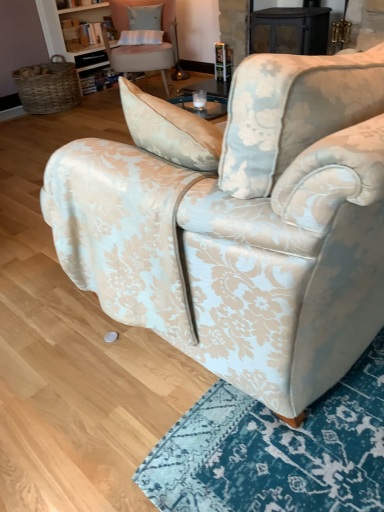
Question: In terms of height, does pastel pink fabric chair at upper center, the second chair viewed from the right, look taller or shorter compared to floral fabric armchair at center, arranged as the first chair when viewed from the right?

Choices:
 (A) short
 (B) tall

Answer: (B)

Question: Looking at their shapes, would you say pastel pink fabric chair at upper center, the second chair viewed from the right, is wider or thinner than floral fabric armchair at center, arranged as the first chair when viewed from the right?

Choices:
 (A) wide
 (B) thin

Answer: (B)

Question: Considering the positions of point (163, 33) and point (48, 167), is point (163, 33) closer or farther from the camera than point (48, 167)?

Choices:
 (A) closer
 (B) farther

Answer: (B)

Question: Considering the positions of floral fabric armchair at center, positioned as the 2th chair in left-to-right order, and pastel pink fabric chair at upper center, the second chair viewed from the right, in the image, is floral fabric armchair at center, positioned as the 2th chair in left-to-right order, bigger or smaller than pastel pink fabric chair at upper center, the second chair viewed from the right,?

Choices:
 (A) small
 (B) big

Answer: (B)

Question: In the image, is floral fabric armchair at center, positioned as the 2th chair in left-to-right order, positioned in front of or behind pastel pink fabric chair at upper center, which appears as the 1th chair when viewed from the left?

Choices:
 (A) front
 (B) behind

Answer: (A)

Question: Which is correct: floral fabric armchair at center, positioned as the 2th chair in left-to-right order, is inside pastel pink fabric chair at upper center, the second chair viewed from the right, or outside of it?

Choices:
 (A) inside
 (B) outside

Answer: (B)

Question: Considering the positions of point (317, 111) and point (168, 4), is point (317, 111) closer or farther from the camera than point (168, 4)?

Choices:
 (A) closer
 (B) farther

Answer: (A)